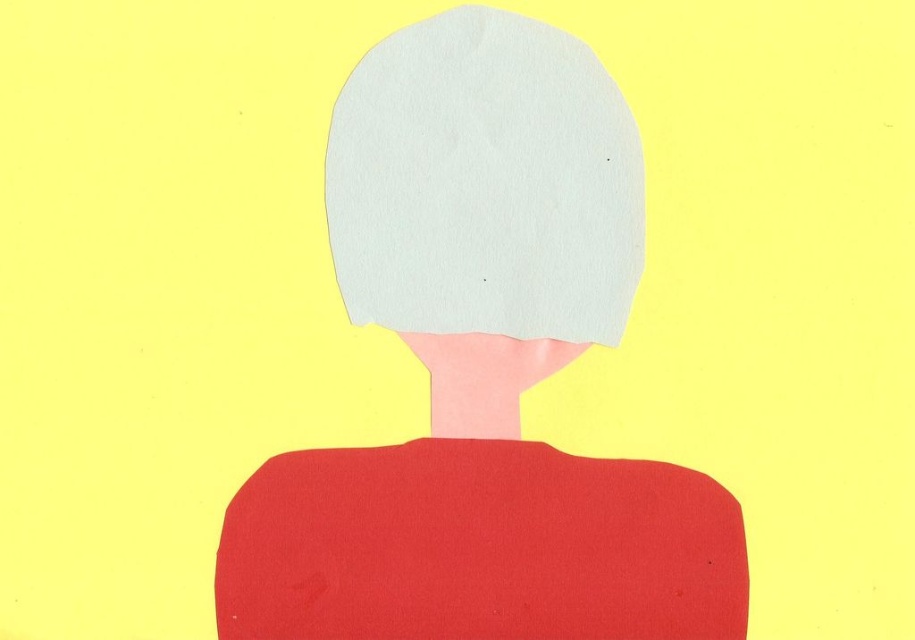
Is point (670, 579) less distant than point (580, 48)?

Yes, it is in front of point (580, 48).

The image size is (915, 640). What do you see at coordinates (482, 371) in the screenshot? I see `white paper head at center` at bounding box center [482, 371].

Where is `white paper head at center`? Image resolution: width=915 pixels, height=640 pixels. white paper head at center is located at coordinates (482, 371).